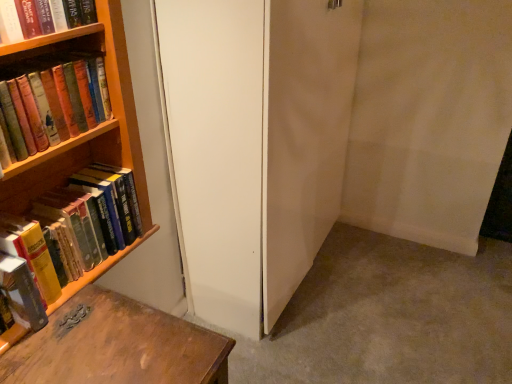
Question: Is white matte screen door at center inside the boundaries of hardcover books at left, marked as the 2th book in a top-to-bottom arrangement, or outside?

Choices:
 (A) outside
 (B) inside

Answer: (A)

Question: In the image, is white matte screen door at center on the left side or the right side of hardcover books at left, which appears as the 3th book when ordered from the bottom?

Choices:
 (A) right
 (B) left

Answer: (A)

Question: Estimate the real-world distances between objects in this image. Which object is closer to the hardcover book at left, the first book in the bottom-to-top sequence?

Choices:
 (A) hardcover books at left, marked as the 2th book in a top-to-bottom arrangement
 (B) white matte screen door at center
 (C) hardcover book at upper left, marked as the first book in a top-to-bottom arrangement
 (D) hardcover books at left, which is the 2th book in bottom-to-top order

Answer: (D)

Question: Which object is the closest to the hardcover book at left, positioned as the fourth book in top-to-bottom order?

Choices:
 (A) hardcover books at left, marked as the 3th book in a top-to-bottom arrangement
 (B) hardcover books at left, marked as the 2th book in a top-to-bottom arrangement
 (C) white matte screen door at center
 (D) hardcover book at upper left, which is the 4th book in bottom-to-top order

Answer: (A)